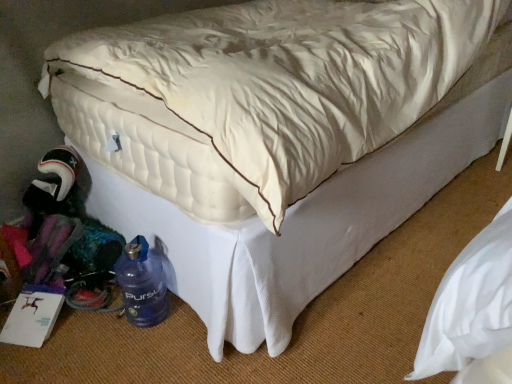
You are a GUI agent. You are given a task and a screenshot of the screen. Output one action in this format:
    pyautogui.click(x=<x>, y=<y>)
    Task: Click on the blue translucent water bottle at lower left
    The height and width of the screenshot is (384, 512).
    Given the screenshot: What is the action you would take?
    click(142, 284)

In order to face blue translucent water bottle at lower left, should I rotate leftwards or rightwards?

A: To face it directly, rotate left by 15.777 degrees.

The image size is (512, 384). Describe the element at coordinates (142, 284) in the screenshot. I see `blue translucent water bottle at lower left` at that location.

Where is `blue translucent water bottle at lower left`? blue translucent water bottle at lower left is located at coordinates (142, 284).